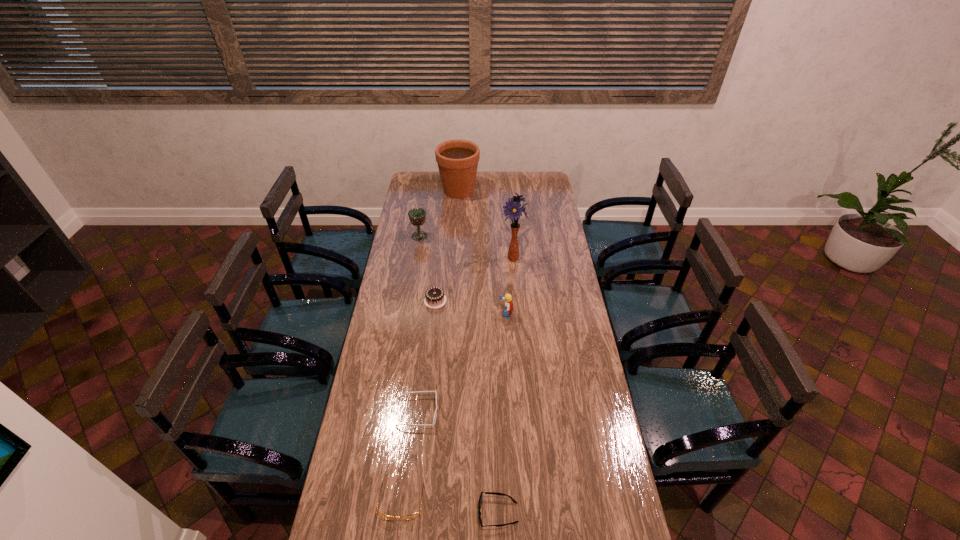
Image resolution: width=960 pixels, height=540 pixels. What are the coordinates of `flower arrangement` in the screenshot? It's located at (514, 211).

Image resolution: width=960 pixels, height=540 pixels. In order to click on the tallest object in this screenshot , I will do `click(514, 211)`.

Where is `the second tallest object`? The image size is (960, 540). the second tallest object is located at coordinates (457, 160).

Identify the location of flowerpot. The width and height of the screenshot is (960, 540). (457, 160).

This screenshot has height=540, width=960. Identify the location of chalice. (417, 216).

Find the location of a particular element. The height and width of the screenshot is (540, 960). the sixth shortest object is located at coordinates (417, 216).

Locate an element on the screen. Lego is located at coordinates (508, 310).

I want to click on chocolate cake, so click(434, 298).

You are a GUI agent. You are given a task and a screenshot of the screen. Output one action in this format:
    pyautogui.click(x=<x>, y=<y>)
    Task: Click on the farther sunglasses
    Image resolution: width=960 pixels, height=540 pixels.
    Given the screenshot: What is the action you would take?
    [434, 419]

At what (x,y) coordinates should I click in order to perform the action: click on the taller sunglasses. Please return your answer as a coordinate pair (x, y). The height and width of the screenshot is (540, 960). Looking at the image, I should click on (434, 419).